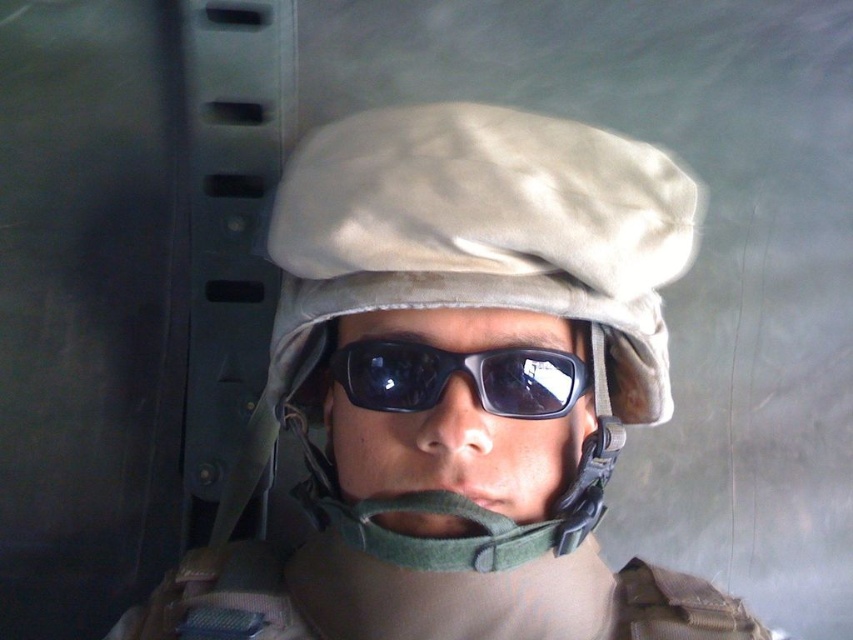
You are a photographer trying to capture the best angle of the person in the image. You notice two points marked on the image, point 1 at coordinates point (438,148) and point 2 at coordinates point (550,412). Which point is nearer to the camera?

Point (438,148) is closer to the camera than point (550,412).

You are a photographer setting up a shoot in a dimly lit studio with metallic walls. You have a camera focused on the tan fabric helmet at center and the black matte sunglasses at center. Since the lighting is low, you want to ensure that the subject closer to you is properly exposed. Which object should you adjust the camera exposure for first?

The tan fabric helmet at center is closer to the viewer than the black matte sunglasses at center, so you should adjust the camera exposure for the tan fabric helmet at center first to ensure proper exposure for the closer subject.

You are a photographer setting up a shot of the tan fabric helmet at center. The camera you are using has a minimum focusing distance of 18 inches. Will you need to move closer or farther away to ensure the helmet is in focus?

The tan fabric helmet at center is 19.46 inches from viewer. Since the camera requires a minimum focusing distance of 18 inches, you are already within range. To ensure focus, you can stay at your current distance or move slightly closer, but not closer than 18 inches.